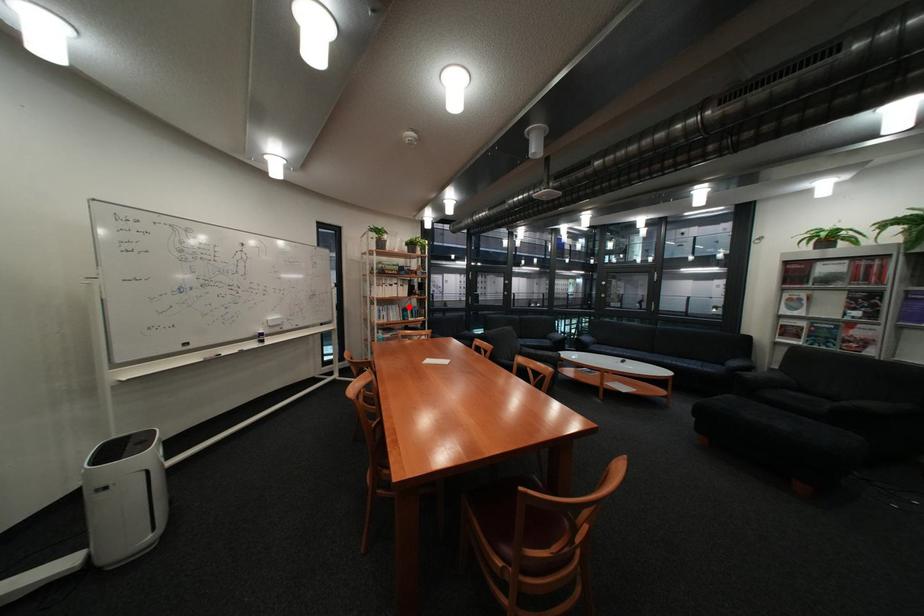
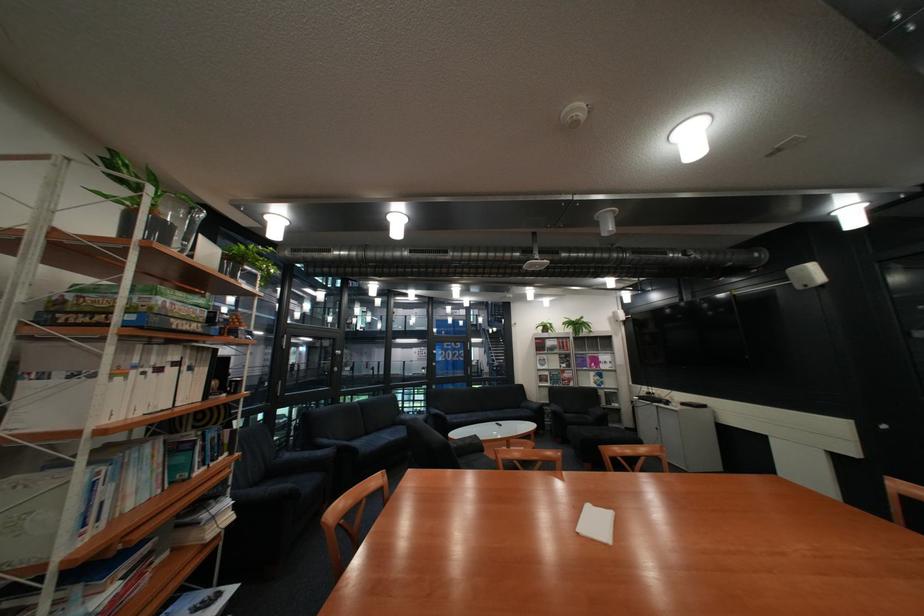
Locate, in the second image, the point that corresponds to the highlighted location in the first image.

(163, 448)